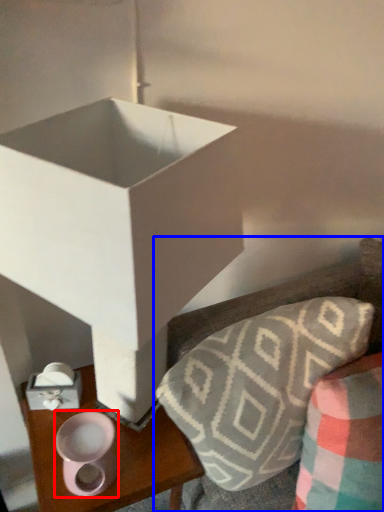
Question: Which object is closer to the camera taking this photo, candle holder (highlighted by a red box) or furniture (highlighted by a blue box)?

Choices:
 (A) candle holder
 (B) furniture

Answer: (B)